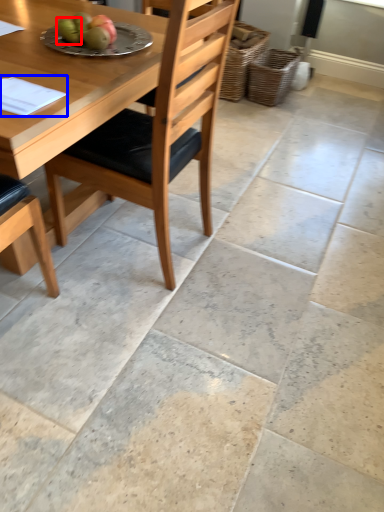
Question: Which object is further to the camera taking this photo, fruit (highlighted by a red box) or notepad (highlighted by a blue box)?

Choices:
 (A) fruit
 (B) notepad

Answer: (A)